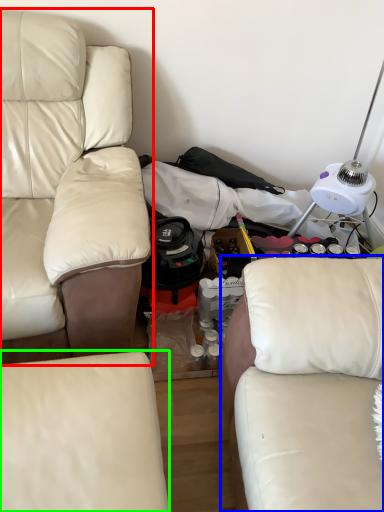
Question: Which object is the farthest from studio couch (highlighted by a red box)? Choose among these: studio couch (highlighted by a blue box) or studio couch (highlighted by a green box).

Choices:
 (A) studio couch
 (B) studio couch

Answer: (A)